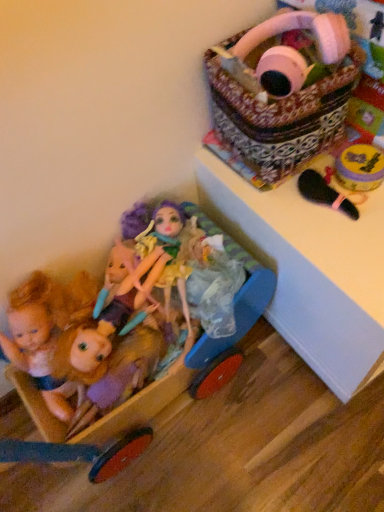
Question: From a real-world perspective, is pastel purple fabric doll at lower left, which is the second doll from right to left, on shiny purple hair at center, the 1th doll when ordered from right to left?

Choices:
 (A) no
 (B) yes

Answer: (A)

Question: Is the position of pastel purple fabric doll at lower left, placed as the 2th doll when sorted from left to right, more distant than that of shiny purple hair at center, the 1th doll when ordered from right to left?

Choices:
 (A) yes
 (B) no

Answer: (B)

Question: Is pastel purple fabric doll at lower left, which is the second doll from right to left, wider than shiny purple hair at center, the 1th doll when ordered from right to left?

Choices:
 (A) yes
 (B) no

Answer: (A)

Question: Considering the relative sizes of pastel purple fabric doll at lower left, which is the second doll from right to left, and shiny purple hair at center, which appears as the third doll when viewed from the left, in the image provided, is pastel purple fabric doll at lower left, which is the second doll from right to left, shorter than shiny purple hair at center, which appears as the third doll when viewed from the left,?

Choices:
 (A) no
 (B) yes

Answer: (B)

Question: From a real-world perspective, is pastel purple fabric doll at lower left, which is the second doll from right to left, located beneath shiny purple hair at center, the 1th doll when ordered from right to left?

Choices:
 (A) yes
 (B) no

Answer: (A)

Question: Is pastel purple fabric doll at lower left, which is the second doll from right to left, in front of or behind shiny purple hair at center, the 1th doll when ordered from right to left, in the image?

Choices:
 (A) front
 (B) behind

Answer: (A)

Question: Looking at their shapes, would you say pastel purple fabric doll at lower left, which is the second doll from right to left, is wider or thinner than shiny purple hair at center, which appears as the third doll when viewed from the left?

Choices:
 (A) thin
 (B) wide

Answer: (B)

Question: From the image's perspective, is pastel purple fabric doll at lower left, placed as the 2th doll when sorted from left to right, located above or below shiny purple hair at center, which appears as the third doll when viewed from the left?

Choices:
 (A) above
 (B) below

Answer: (B)

Question: Looking at the image, does pastel purple fabric doll at lower left, placed as the 2th doll when sorted from left to right, seem bigger or smaller compared to shiny purple hair at center, the 1th doll when ordered from right to left?

Choices:
 (A) big
 (B) small

Answer: (B)

Question: From the image's perspective, relative to pastel purple fabric doll at lower left, which is the second doll from right to left, is white glossy changing table at upper right above or below?

Choices:
 (A) above
 (B) below

Answer: (A)

Question: In the image, is white glossy changing table at upper right on the left side or the right side of pastel purple fabric doll at lower left, placed as the 2th doll when sorted from left to right?

Choices:
 (A) right
 (B) left

Answer: (A)

Question: In terms of height, does white glossy changing table at upper right look taller or shorter compared to pastel purple fabric doll at lower left, which is the second doll from right to left?

Choices:
 (A) short
 (B) tall

Answer: (B)

Question: Relative to pastel purple fabric doll at lower left, placed as the 2th doll when sorted from left to right, is white glossy changing table at upper right in front or behind?

Choices:
 (A) front
 (B) behind

Answer: (A)

Question: Looking at the image, does patterned fabric basket at upper right seem bigger or smaller compared to wooden baby carriage at lower left?

Choices:
 (A) small
 (B) big

Answer: (A)

Question: From the image's perspective, is patterned fabric basket at upper right located above or below wooden baby carriage at lower left?

Choices:
 (A) above
 (B) below

Answer: (A)